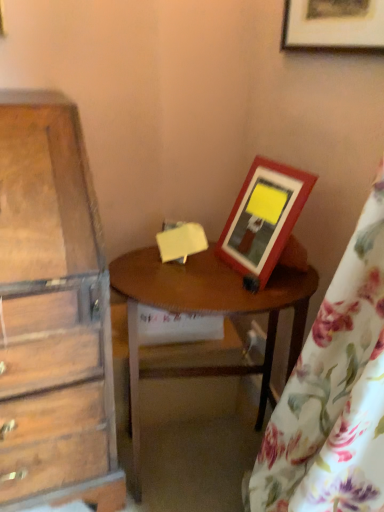
Question: Would you consider floral fabric curtain at right to be distant from wooden picture frame at upper right, marked as the 1th picture frame in a bottom-to-top arrangement?

Choices:
 (A) yes
 (B) no

Answer: (B)

Question: Can you confirm if floral fabric curtain at right is taller than wooden picture frame at upper right, marked as the 1th picture frame in a bottom-to-top arrangement?

Choices:
 (A) yes
 (B) no

Answer: (A)

Question: From a real-world perspective, is floral fabric curtain at right located higher than wooden picture frame at upper right, acting as the second picture frame starting from the top?

Choices:
 (A) yes
 (B) no

Answer: (B)

Question: From a real-world perspective, is floral fabric curtain at right below wooden picture frame at upper right, acting as the second picture frame starting from the top?

Choices:
 (A) no
 (B) yes

Answer: (B)

Question: Is floral fabric curtain at right to the left of wooden picture frame at upper right, acting as the second picture frame starting from the top, from the viewer's perspective?

Choices:
 (A) no
 (B) yes

Answer: (A)

Question: From the image's perspective, does floral fabric curtain at right appear lower than wooden picture frame at upper right, acting as the second picture frame starting from the top?

Choices:
 (A) yes
 (B) no

Answer: (A)

Question: Is wooden table at center positioned beyond the bounds of floral fabric curtain at right?

Choices:
 (A) no
 (B) yes

Answer: (B)

Question: Does wooden table at center have a smaller size compared to floral fabric curtain at right?

Choices:
 (A) no
 (B) yes

Answer: (B)

Question: Could you tell me if wooden table at center is turned towards floral fabric curtain at right?

Choices:
 (A) no
 (B) yes

Answer: (B)

Question: From the image's perspective, does wooden table at center appear lower than floral fabric curtain at right?

Choices:
 (A) yes
 (B) no

Answer: (A)

Question: Does wooden table at center appear on the right side of floral fabric curtain at right?

Choices:
 (A) no
 (B) yes

Answer: (A)

Question: Considering the relative sizes of wooden table at center and floral fabric curtain at right in the image provided, is wooden table at center thinner than floral fabric curtain at right?

Choices:
 (A) yes
 (B) no

Answer: (A)

Question: Considering the relative positions of wooden picture frame at upper right, marked as the 1th picture frame in a bottom-to-top arrangement, and floral fabric curtain at right in the image provided, is wooden picture frame at upper right, marked as the 1th picture frame in a bottom-to-top arrangement, to the left of floral fabric curtain at right from the viewer's perspective?

Choices:
 (A) yes
 (B) no

Answer: (A)